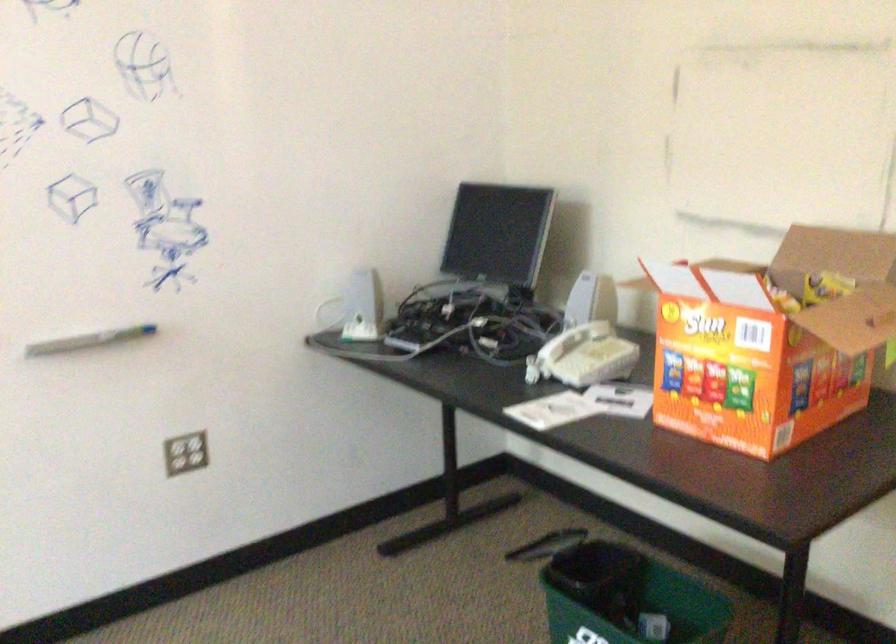
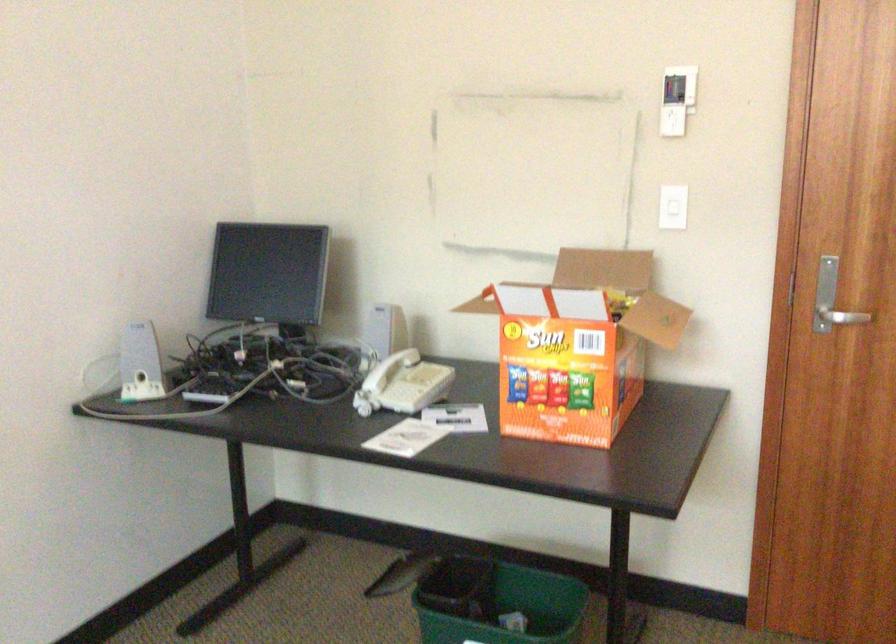
The point at (580,298) is marked in the first image. Where is the corresponding point in the second image?

(384, 328)